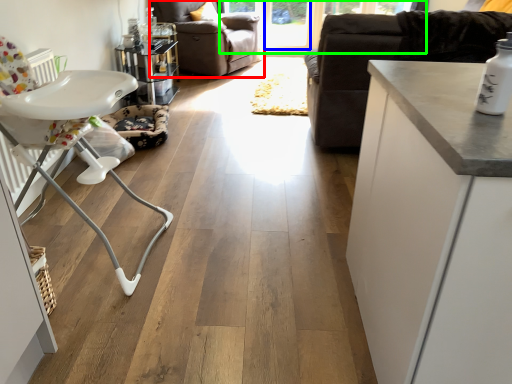
Question: Which is nearer to the chair (highlighted by a red box)? window screen (highlighted by a blue box) or window screen (highlighted by a green box).

Choices:
 (A) window screen
 (B) window screen

Answer: (B)